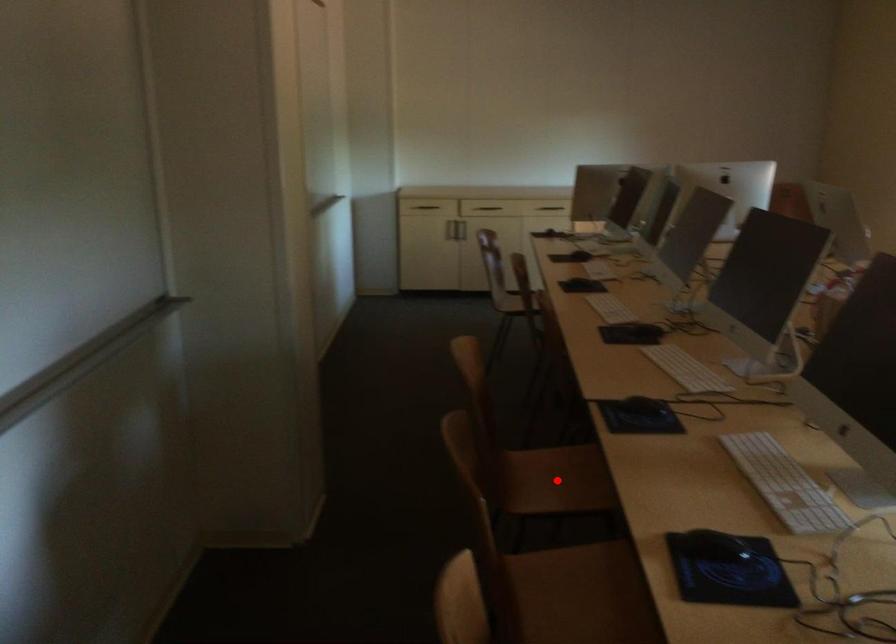
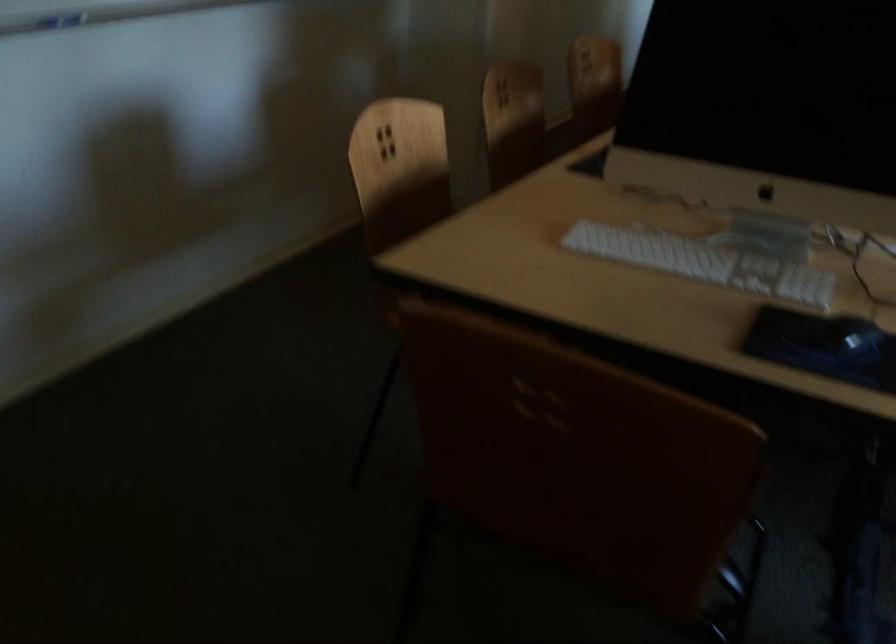
Question: I am providing you with two images of the same scene from different viewpoints. A red point is marked on the first image. Can you still see the location of the red point in image 2?

Choices:
 (A) Yes
 (B) No

Answer: (B)